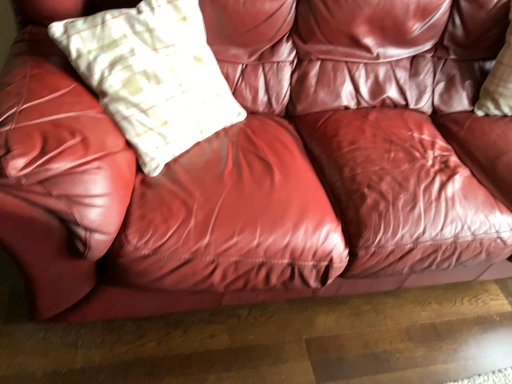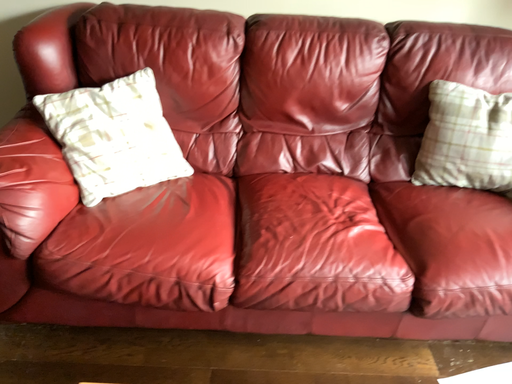
Question: Which way did the camera rotate in the video?

Choices:
 (A) rotated right
 (B) rotated left

Answer: (B)